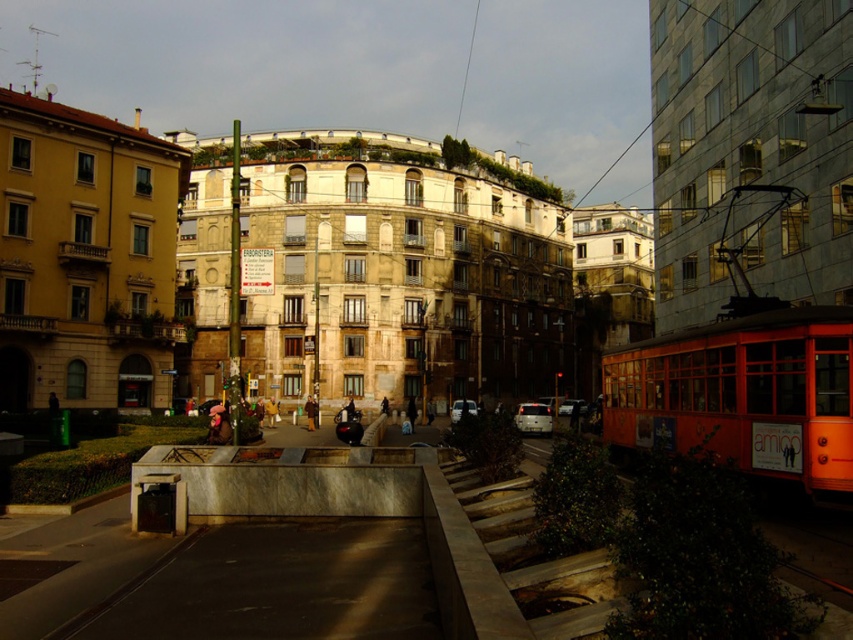
Question: Is matte black car at center above silver metallic car at center?

Choices:
 (A) yes
 (B) no

Answer: (A)

Question: Which object is the farthest from the white glossy car at center?

Choices:
 (A) matte black car at center
 (B) silver metallic car at center

Answer: (B)

Question: Which point is farther to the camera?

Choices:
 (A) (461, 410)
 (B) (579, 400)

Answer: (B)

Question: Which object is the farthest from the silver metallic car at center?

Choices:
 (A) white glossy car at center
 (B) matte black car at center

Answer: (A)

Question: Can you confirm if matte black car at center is positioned above white glossy car at center?

Choices:
 (A) yes
 (B) no

Answer: (B)

Question: Does matte black car at center have a lesser width compared to silver metallic car at center?

Choices:
 (A) no
 (B) yes

Answer: (A)